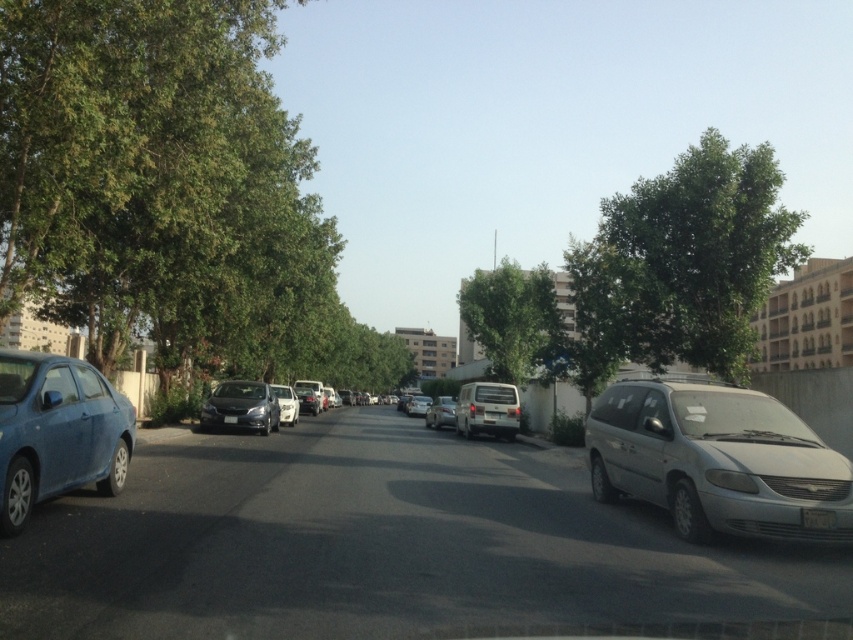
You are a pedestrian standing on the sidewalk and want to cross the street. You see a green leafy tree at upper right and a white plastic license plate at lower right. Which object is closer to you as you look towards the street?

The green leafy tree at upper right is closer to you because the white plastic license plate at lower right is behind it, meaning the tree is in front.

You are standing on the sidewalk and want to cross the street to reach the green leafy tree at left. However, there is a silver metallic minivan at right blocking your path. Which object is closer to you, the tree or the minivan?

The green leafy tree at left is closer to you because it is further to the viewer than the silver metallic minivan at right, meaning it is positioned nearer in the scene.

You are standing at the center of the street and want to look towards the green leafy tree at upper right. In which direction should you turn your head?

The green leafy tree at upper right is located at coordinates 0.411 on the x axis and 0.802 on the y axis, so you should turn your head towards the upper right direction to look at it.